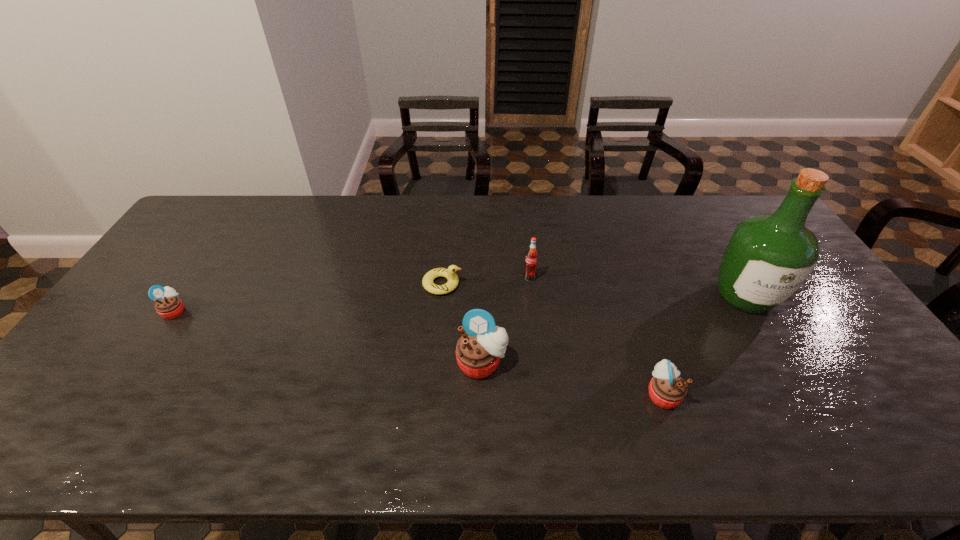
Find the location of `vacant space located 0.050m on the front-facing side of the second muffin from left to right`. vacant space located 0.050m on the front-facing side of the second muffin from left to right is located at coordinates (482, 401).

Identify the location of free space located 0.380m on the front-facing side of the fifth object from left to right. (836, 394).

What are the coordinates of `free region located on the front-facing side of the tallest object` in the screenshot? It's located at (804, 397).

This screenshot has height=540, width=960. What are the coordinates of `free space located on the label of the third object from right to left` in the screenshot? It's located at (535, 319).

Where is `free space located on the face of the shortest object`? The width and height of the screenshot is (960, 540). free space located on the face of the shortest object is located at coordinates (567, 284).

This screenshot has height=540, width=960. What are the coordinates of `object that is positioned at the left edge` in the screenshot? It's located at (168, 305).

Where is `object situated at the right edge`? object situated at the right edge is located at coordinates (769, 256).

Identify the location of vacant space at the far edge of the desktop. (448, 226).

Locate an element on the screen. The height and width of the screenshot is (540, 960). vacant space at the near edge is located at coordinates (152, 394).

Image resolution: width=960 pixels, height=540 pixels. In the image, there is a desktop. Identify the location of vacant space at the right edge. (873, 367).